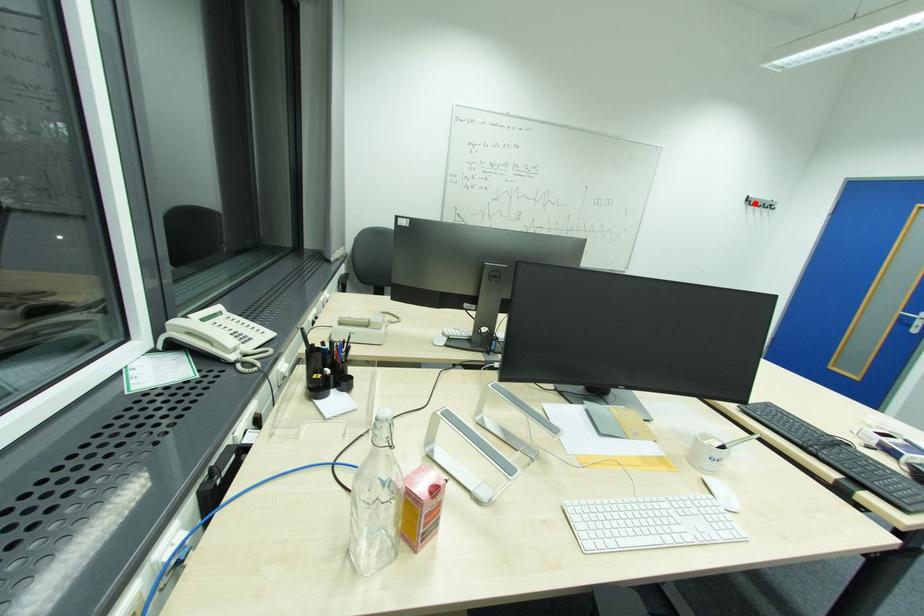
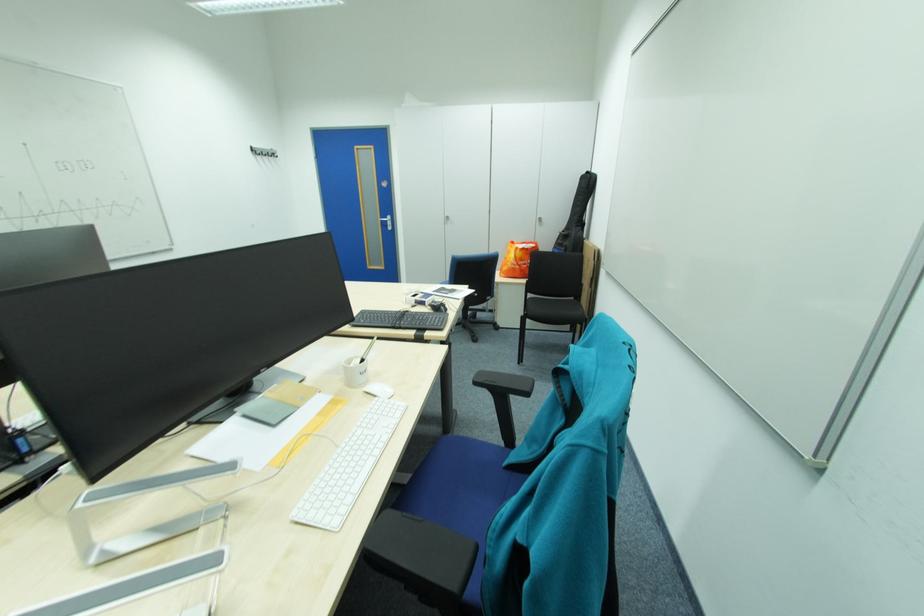
Find the pixel in the second image that matches the highlighted location in the first image.

(262, 153)